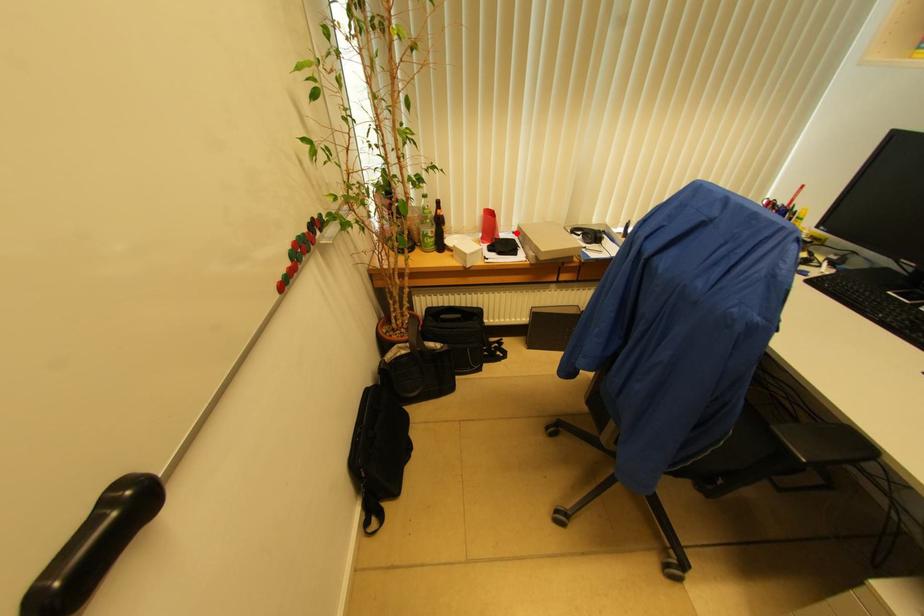
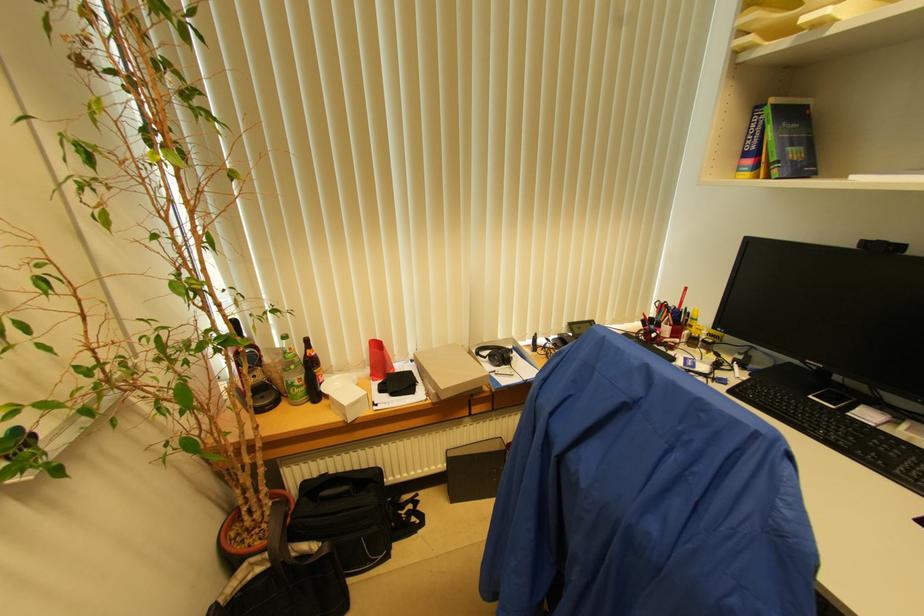
Find the pixel in the second image that matches the highlighted location in the first image.

(415, 361)